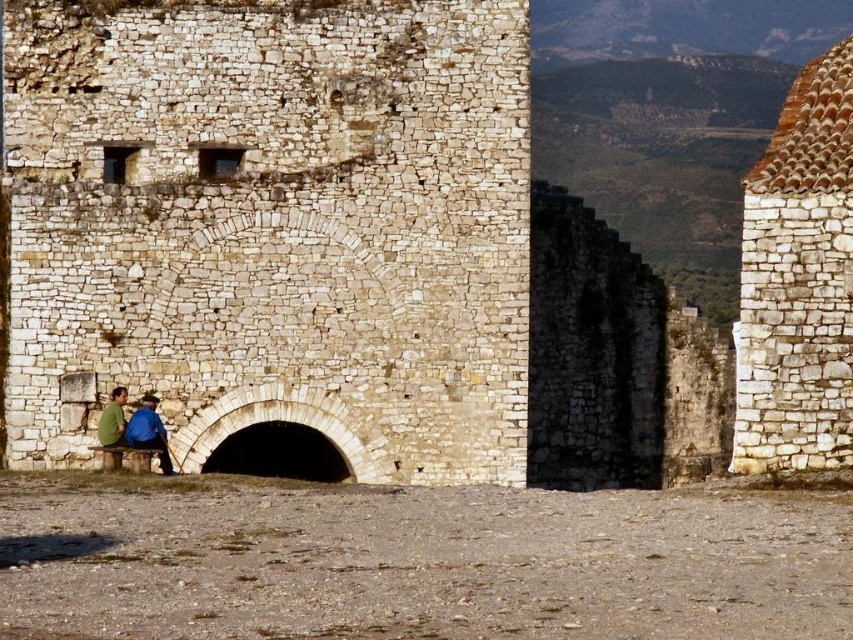
Question: Which object is farther from the camera taking this photo?

Choices:
 (A) white stone roof at upper right
 (B) blue shirt at lower left

Answer: (B)

Question: Is white stone roof at upper right above blue shirt at lower left?

Choices:
 (A) yes
 (B) no

Answer: (A)

Question: Can you confirm if blue shirt at lower left is smaller than green matte shirt at lower left?

Choices:
 (A) no
 (B) yes

Answer: (A)

Question: Is blue shirt at lower left to the left of green matte shirt at lower left from the viewer's perspective?

Choices:
 (A) no
 (B) yes

Answer: (A)

Question: Which object is closer to the camera taking this photo?

Choices:
 (A) blue shirt at lower left
 (B) white stone roof at upper right

Answer: (B)

Question: Estimate the real-world distances between objects in this image. Which object is closer to the green matte shirt at lower left?

Choices:
 (A) blue shirt at lower left
 (B) white stone roof at upper right

Answer: (A)